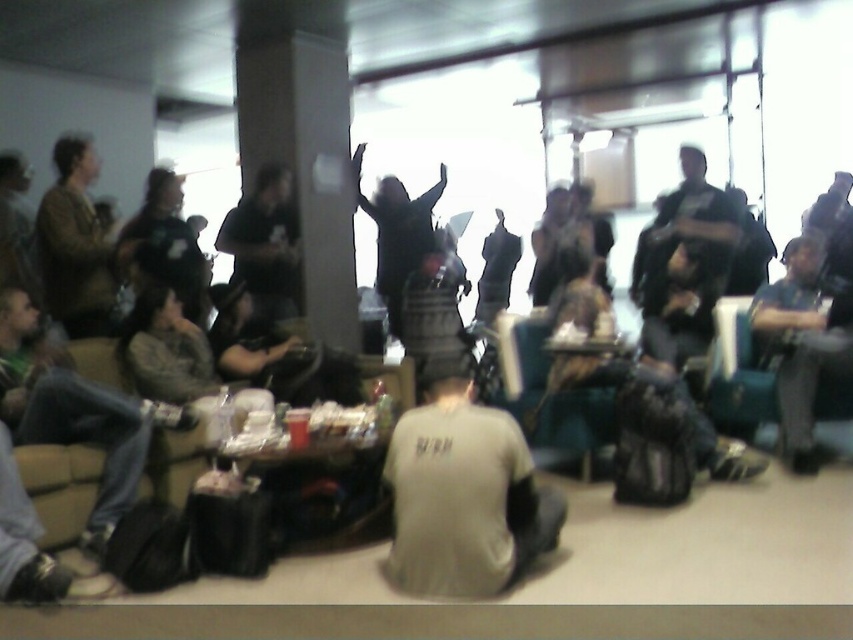
Question: Can you confirm if brown textured jacket at left is positioned to the right of teal fabric armchair at center?

Choices:
 (A) yes
 (B) no

Answer: (B)

Question: Among these objects, which one is nearest to the camera?

Choices:
 (A) gray matte shirt at center
 (B) brown textured jacket at left
 (C) dark gray fabric jacket at lower left
 (D) teal fabric armchair at center

Answer: (A)

Question: Which point is farther to the camera?

Choices:
 (A) brown textured jacket at left
 (B) dark gray fabric jacket at right

Answer: (A)

Question: Observing the image, what is the correct spatial positioning of gray matte shirt at center in reference to teal fabric armchair at center?

Choices:
 (A) above
 (B) below

Answer: (B)

Question: Which of the following is the closest to the observer?

Choices:
 (A) dark gray fabric jacket at lower left
 (B) teal fabric armchair at center
 (C) gray matte shirt at center
 (D) dark gray fabric jacket at right

Answer: (C)

Question: Is dark gray fabric jacket at lower left to the left of brown textured jacket at left from the viewer's perspective?

Choices:
 (A) no
 (B) yes

Answer: (A)